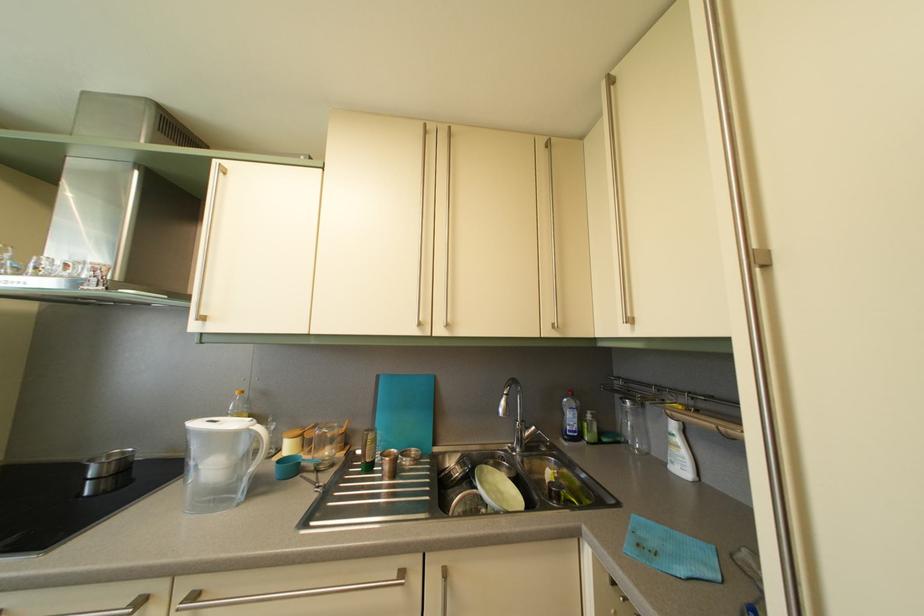
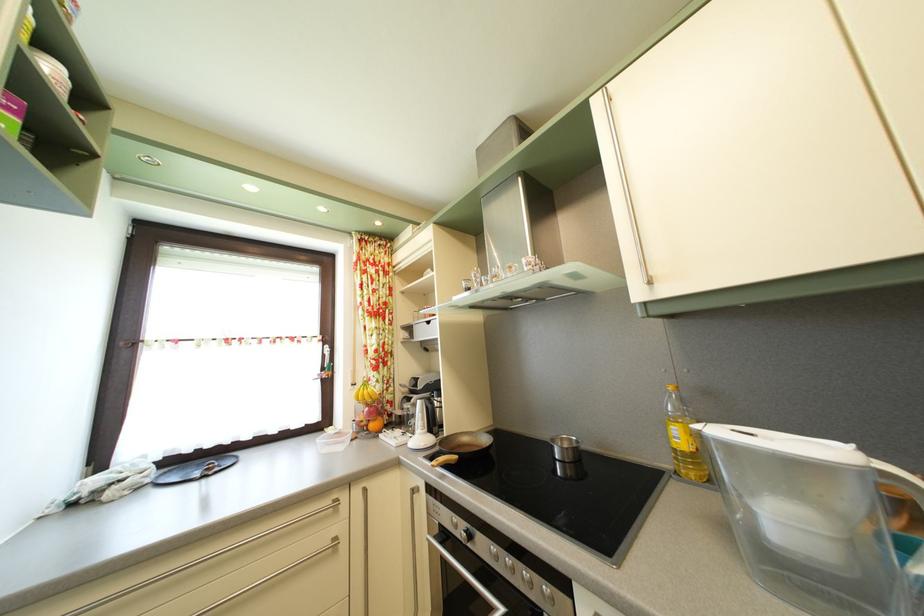
The point at (118, 463) is marked in the first image. Where is the corresponding point in the second image?

(569, 448)